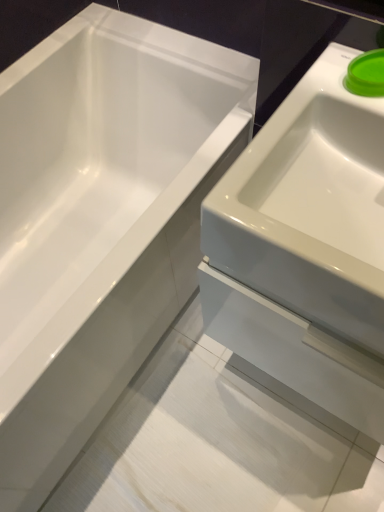
Image resolution: width=384 pixels, height=512 pixels. What are the coordinates of `green plastic lid at upper right` in the screenshot? It's located at (366, 74).

Locate an element on the screen. white glossy sink at right is located at coordinates (x=306, y=247).

Is white glossy bathtub at upper left further to the viewer compared to white glossy sink at right?

Yes, white glossy bathtub at upper left is further from the camera.

Considering the sizes of objects white glossy bathtub at upper left and white glossy sink at right in the image provided, who is shorter, white glossy bathtub at upper left or white glossy sink at right?

With less height is white glossy sink at right.

Locate an element on the screen. bathtub that appears behind the white glossy sink at right is located at coordinates (100, 220).

From the image's perspective, is white glossy sink at right positioned above or below green plastic lid at upper right?

Clearly, from the image's perspective, white glossy sink at right is below green plastic lid at upper right.

Does white glossy sink at right have a lesser width compared to green plastic lid at upper right?

Incorrect, the width of white glossy sink at right is not less than that of green plastic lid at upper right.

Between white glossy sink at right and green plastic lid at upper right, which one appears on the right side from the viewer's perspective?

From the viewer's perspective, white glossy sink at right appears more on the right side.

Considering their positions, is white glossy sink at right located in front of or behind green plastic lid at upper right?

In the image, white glossy sink at right appears in front of green plastic lid at upper right.

Is green plastic lid at upper right positioned with its back to white glossy bathtub at upper left?

No.

How different are the orientations of green plastic lid at upper right and white glossy bathtub at upper left in degrees?

There is a 49.8-degree angle between the facing directions of green plastic lid at upper right and white glossy bathtub at upper left.

In the scene shown: Can we say green plastic lid at upper right lies outside white glossy bathtub at upper left?

That's correct, green plastic lid at upper right is outside of white glossy bathtub at upper left.

Relative to white glossy bathtub at upper left, is green plastic lid at upper right in front or behind?

In the image, green plastic lid at upper right appears behind white glossy bathtub at upper left.

From a real-world perspective, is white glossy sink at right positioned above or below white glossy bathtub at upper left?

white glossy sink at right is above white glossy bathtub at upper left.

Is point (313, 338) behind point (36, 120)?

No, it is not.

Which object is positioned more to the right, white glossy sink at right or white glossy bathtub at upper left?

Positioned to the right is white glossy sink at right.

Looking at this image, can you confirm if white glossy sink at right is wider than white glossy bathtub at upper left?

No.

Is white glossy sink at right a part of green plastic lid at upper right?

No, white glossy sink at right is not inside green plastic lid at upper right.

This screenshot has height=512, width=384. In order to click on liquid on the left of white glossy sink at right in this screenshot , I will do (366, 74).

From a real-world perspective, who is located higher, green plastic lid at upper right or white glossy sink at right?

From a 3D spatial view, green plastic lid at upper right is above.

Is point (368, 66) closer to viewer compared to point (371, 101)?

No, (368, 66) is further to viewer.

Consider the image. Is white glossy bathtub at upper left oriented towards green plastic lid at upper right?

No, white glossy bathtub at upper left is not aimed at green plastic lid at upper right.

Would you say white glossy bathtub at upper left is inside or outside green plastic lid at upper right?

The correct answer is: outside.

Between white glossy bathtub at upper left and green plastic lid at upper right, which one appears on the left side from the viewer's perspective?

white glossy bathtub at upper left.

Which is in front, point (22, 277) or point (375, 67)?

The point (375, 67) is closer.

The image size is (384, 512). Find the location of `sink that is above the white glossy bathtub at upper left (from a real-world perspective)`. sink that is above the white glossy bathtub at upper left (from a real-world perspective) is located at coordinates (306, 247).

The height and width of the screenshot is (512, 384). I want to click on sink below the green plastic lid at upper right (from the image's perspective), so click(x=306, y=247).

Considering their positions, is green plastic lid at upper right positioned closer to white glossy bathtub at upper left than white glossy sink at right?

Among the two, white glossy sink at right is located nearer to white glossy bathtub at upper left.

Based on their spatial positions, is green plastic lid at upper right or white glossy bathtub at upper left further from white glossy sink at right?

Based on the image, white glossy bathtub at upper left appears to be further to white glossy sink at right.

When comparing their distances from white glossy sink at right, does white glossy bathtub at upper left or green plastic lid at upper right seem further?

white glossy bathtub at upper left is positioned further to the anchor white glossy sink at right.

In the scene shown: Estimate the real-world distances between objects in this image. Which object is closer to white glossy bathtub at upper left, white glossy sink at right or green plastic lid at upper right?

Among the two, white glossy sink at right is located nearer to white glossy bathtub at upper left.

From the image, which object appears to be nearer to green plastic lid at upper right, white glossy sink at right or white glossy bathtub at upper left?

The object closer to green plastic lid at upper right is white glossy sink at right.

Which object lies nearer to the anchor point green plastic lid at upper right, white glossy bathtub at upper left or white glossy sink at right?

white glossy sink at right is closer to green plastic lid at upper right.

The width and height of the screenshot is (384, 512). I want to click on liquid between white glossy bathtub at upper left and white glossy sink at right, so click(366, 74).